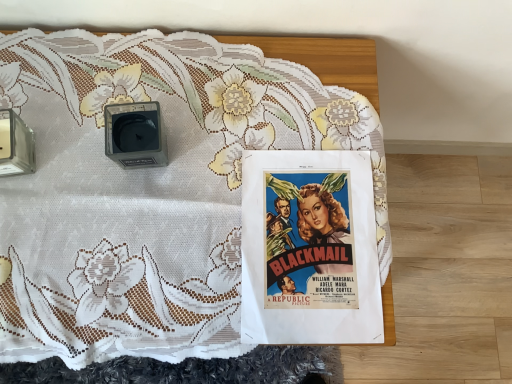
This screenshot has width=512, height=384. Find the location of `free space above white lace tablecloth at center (from a real-world perspective)`. free space above white lace tablecloth at center (from a real-world perspective) is located at coordinates (176, 236).